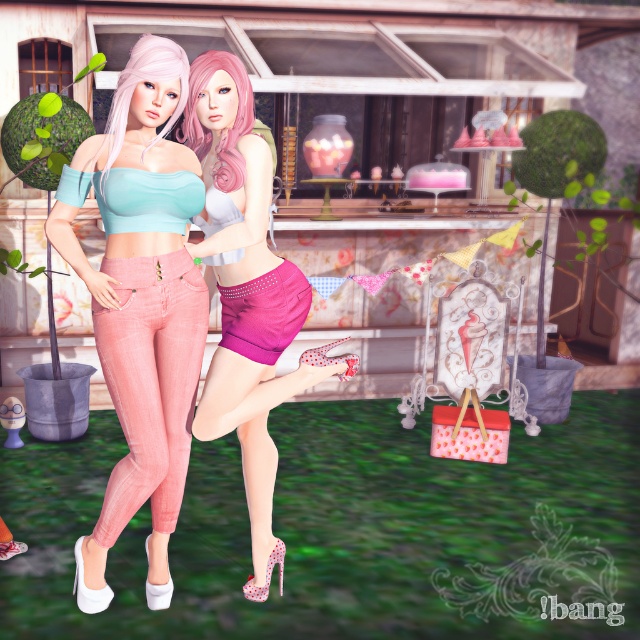
You are a photographer trying to capture both the matte pink shorts at center and the shiny magenta shorts at center in a single shot. Which pair of shorts will appear larger in the photo?

The matte pink shorts at center will appear larger in the photo because it is closer to the viewer than the shiny magenta shorts at center.